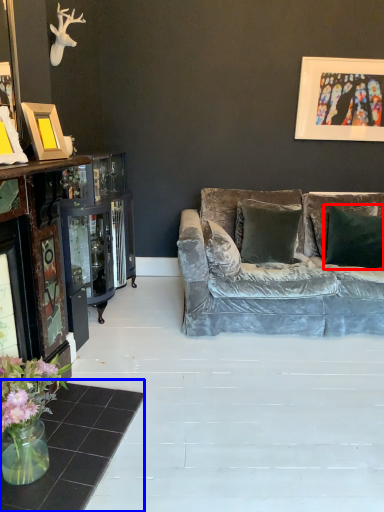
Question: Among these objects, which one is nearest to the camera, pillow (highlighted by a red box) or table (highlighted by a blue box)?

Choices:
 (A) pillow
 (B) table

Answer: (B)